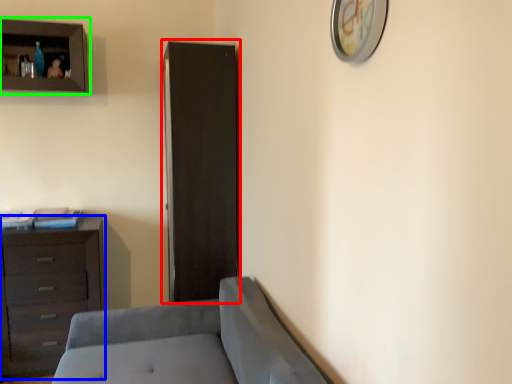
Question: Which object is the closest to the file cabinet (highlighted by a red box)? Choose among these: chest of drawers (highlighted by a blue box) or cupboard (highlighted by a green box).

Choices:
 (A) chest of drawers
 (B) cupboard

Answer: (A)